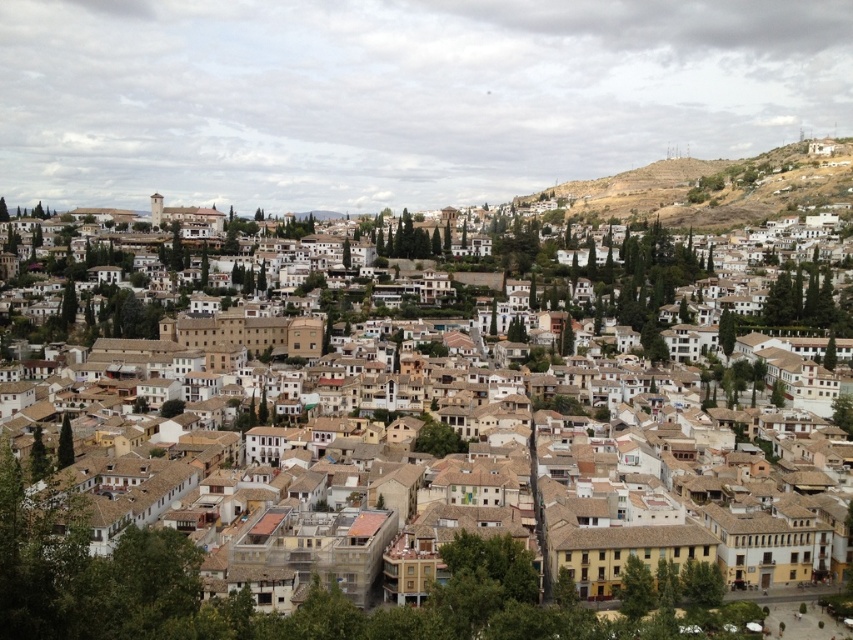
Question: In this image, where is brown clay roof tiles at center located relative to brown rocky hillside at upper right?

Choices:
 (A) below
 (B) above

Answer: (A)

Question: Which point appears farthest from the camera in this image?

Choices:
 (A) (706, 227)
 (B) (492, 572)

Answer: (A)

Question: Can you confirm if brown clay roof tiles at center is positioned below brown rocky hillside at upper right?

Choices:
 (A) no
 (B) yes

Answer: (B)

Question: Which point is closer to the camera?

Choices:
 (A) brown clay roof tiles at center
 (B) brown rocky hillside at upper right

Answer: (A)

Question: Is brown clay roof tiles at center wider than brown rocky hillside at upper right?

Choices:
 (A) no
 (B) yes

Answer: (B)